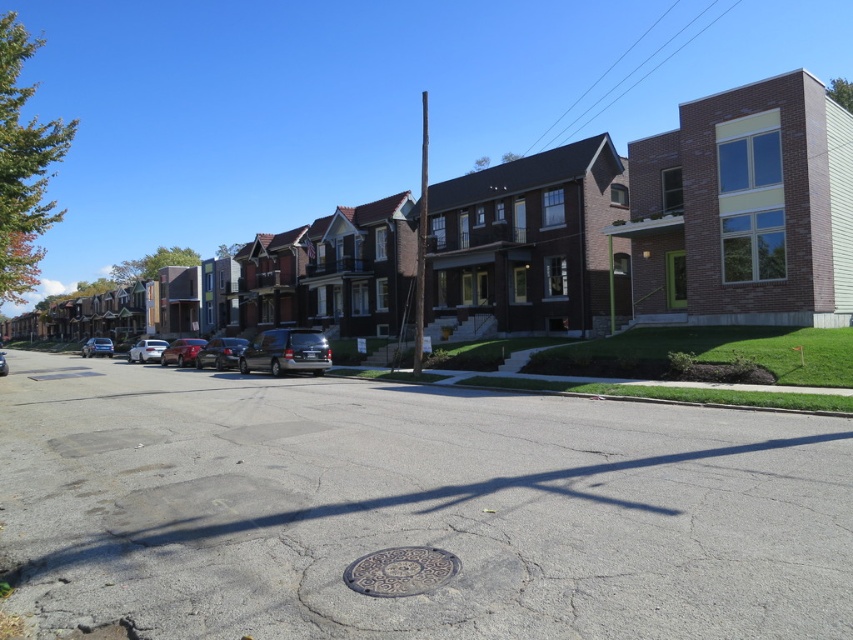
Question: Which point is closer to the camera?

Choices:
 (A) (402, 560)
 (B) (4, 374)
 (C) (213, 365)
 (D) (196, 349)

Answer: (A)

Question: From the image, what is the correct spatial relationship of gold textured manhole cover at center in relation to satin blue sedan at left?

Choices:
 (A) above
 (B) below

Answer: (B)

Question: Which object is closer to the camera taking this photo?

Choices:
 (A) gold textured manhole cover at center
 (B) satin black sedan at center

Answer: (A)

Question: Which of the following is the closest to the observer?

Choices:
 (A) satin blue sedan at left
 (B) satin silver sedan at center

Answer: (B)

Question: Is gold textured manhole cover at center wider than satin blue sedan at left?

Choices:
 (A) no
 (B) yes

Answer: (A)

Question: Can you confirm if metallic silver sedan at center is thinner than satin silver sedan at center?

Choices:
 (A) no
 (B) yes

Answer: (B)